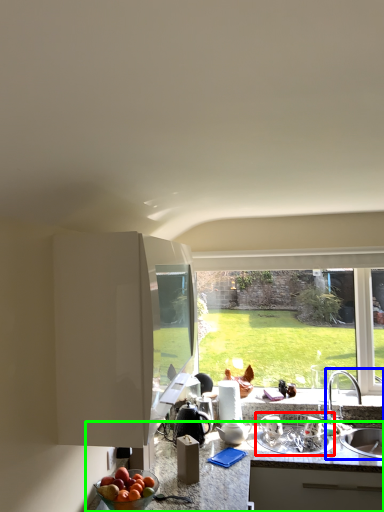
Question: Based on their relative distances, which object is nearer to appliance (highlighted by a red box)? Choose from sink (highlighted by a blue box) and countertop (highlighted by a green box).

Choices:
 (A) sink
 (B) countertop

Answer: (B)